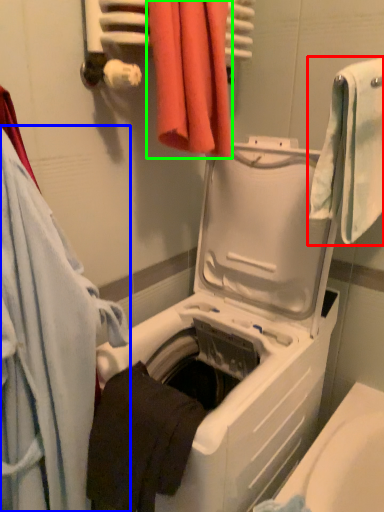
Question: Which object is the farthest from towel (highlighted by a red box)? Choose among these: towel (highlighted by a blue box) or towel (highlighted by a green box).

Choices:
 (A) towel
 (B) towel

Answer: (A)